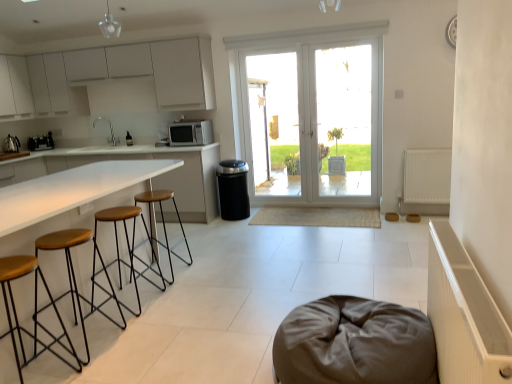
Identify the location of vacant space that's between white matte countertop at left and brown fabric bean bag at lower right. This screenshot has height=384, width=512. (215, 313).